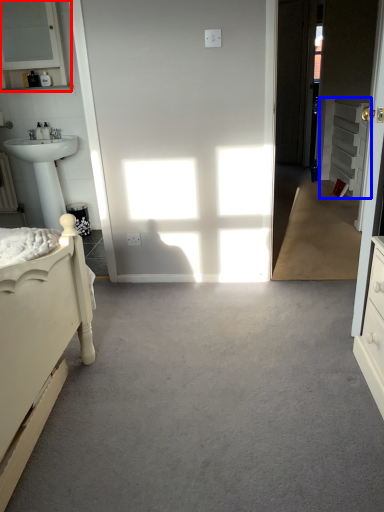
Question: Among these objects, which one is nearest to the camera, medicine cabinet (highlighted by a red box) or cabinetry (highlighted by a blue box)?

Choices:
 (A) medicine cabinet
 (B) cabinetry

Answer: (A)